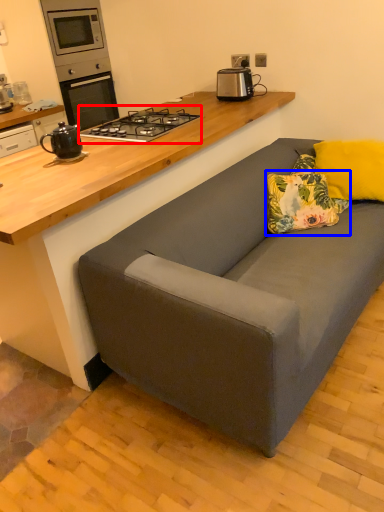
Question: Which point is closer to the camera, gas stove (highlighted by a red box) or pillow (highlighted by a blue box)?

Choices:
 (A) gas stove
 (B) pillow

Answer: (B)